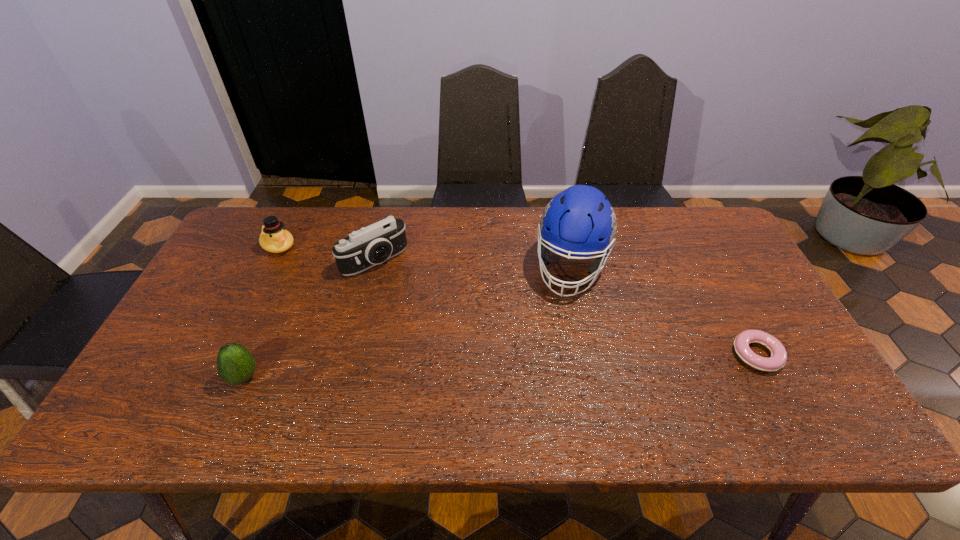
Locate an element on the screen. vacant space at the far right corner of the desktop is located at coordinates (699, 227).

In order to click on unoccupied position between the duck and the third object from right to left in this screenshot , I will do `click(326, 253)`.

Identify the location of empty location between the avocado and the rightmost object. The width and height of the screenshot is (960, 540). (500, 366).

This screenshot has height=540, width=960. In order to click on free space between the duck and the avocado in this screenshot , I will do `click(261, 312)`.

Where is `vacant point located between the avocado and the second object from right to left`? This screenshot has width=960, height=540. vacant point located between the avocado and the second object from right to left is located at coordinates (408, 322).

This screenshot has width=960, height=540. I want to click on free space between the fourth object from left to right and the avocado, so click(408, 322).

At what (x,y) coordinates should I click in order to perform the action: click on vacant region between the avocado and the duck. Please return your answer as a coordinate pair (x, y). The width and height of the screenshot is (960, 540). Looking at the image, I should click on (261, 312).

You are a GUI agent. You are given a task and a screenshot of the screen. Output one action in this format:
    pyautogui.click(x=<x>, y=<y>)
    Task: Click on the free space between the tallest object and the duck
    The width and height of the screenshot is (960, 540).
    Given the screenshot: What is the action you would take?
    [425, 257]

At what (x,y) coordinates should I click in order to perform the action: click on vacant area between the duck and the football helmet. Please return your answer as a coordinate pair (x, y). Image resolution: width=960 pixels, height=540 pixels. Looking at the image, I should click on (425, 257).

This screenshot has width=960, height=540. Identify the location of free area in between the shortest object and the duck. (517, 300).